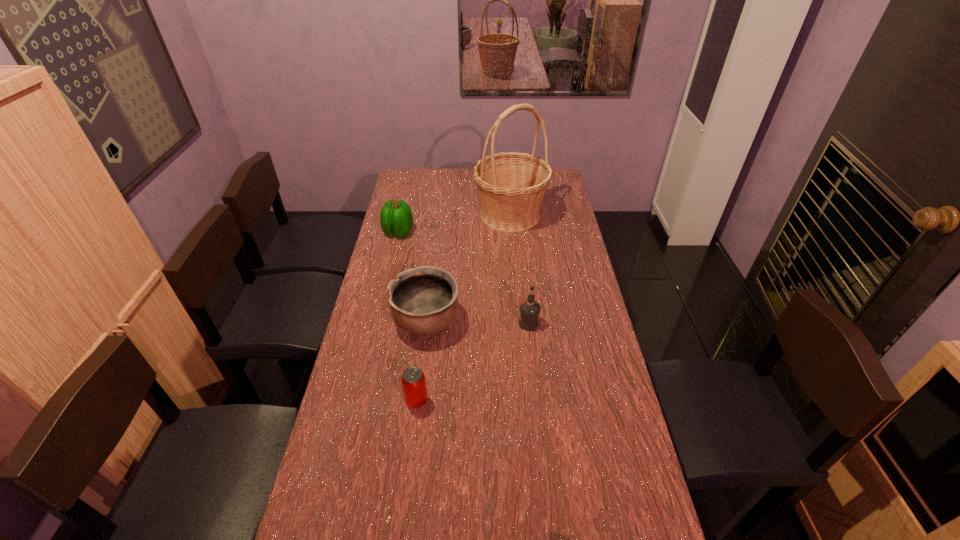
What are the coordinates of `basket` in the screenshot? It's located at [x=511, y=185].

The width and height of the screenshot is (960, 540). Identify the location of vodka. (529, 309).

In order to click on bell pepper in this screenshot , I will do `click(396, 219)`.

Where is `pottery`? The height and width of the screenshot is (540, 960). pottery is located at coordinates pyautogui.click(x=423, y=300).

Where is `the shortest object`? The height and width of the screenshot is (540, 960). the shortest object is located at coordinates (413, 380).

Identify the location of the nearest object. (413, 380).

At what (x,y) coordinates should I click in order to perform the action: click on free space located on the front of the tallest object. Please return your answer as a coordinate pair (x, y). This screenshot has width=960, height=540. Looking at the image, I should click on (517, 290).

Image resolution: width=960 pixels, height=540 pixels. I want to click on blank area located 0.120m on the front label of the vodka, so click(x=484, y=323).

Locate an element on the screen. blank space located on the front label of the vodka is located at coordinates (465, 323).

Where is `vacant space situated 0.310m on the front label of the vodka`? Image resolution: width=960 pixels, height=540 pixels. vacant space situated 0.310m on the front label of the vodka is located at coordinates (430, 323).